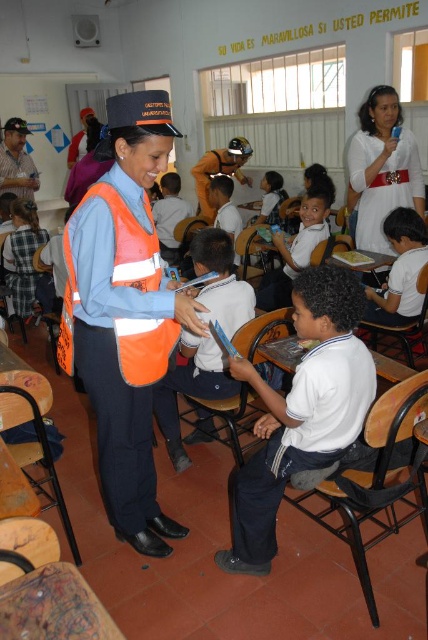
Consider the image. You are a student sitting at the desk in the classroom. You see the white smooth shirt at center and the orange reflective safety vest at center. Which one is closer to you?

The white smooth shirt at center is closer to you because it is in front of the orange reflective safety vest at center.

Looking at this image, what are the coordinates of the white smooth shirt at center?

The white smooth shirt at center is located at coordinates point (300, 412).